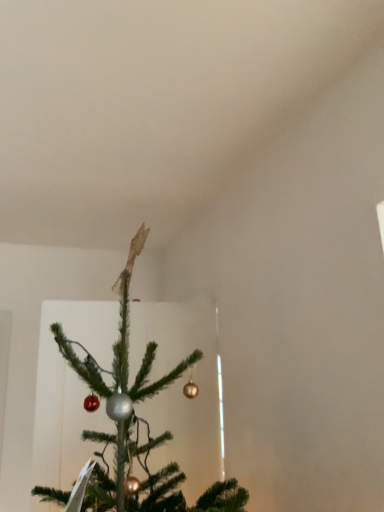
Locate an element on the screen. Image resolution: width=384 pixels, height=512 pixels. shiny metallic ornaments at center is located at coordinates (131, 403).

This screenshot has width=384, height=512. What do you see at coordinates (131, 403) in the screenshot?
I see `shiny metallic ornaments at center` at bounding box center [131, 403].

Find the location of a particular element. This screenshot has width=384, height=512. shiny metallic ornaments at center is located at coordinates (131, 403).